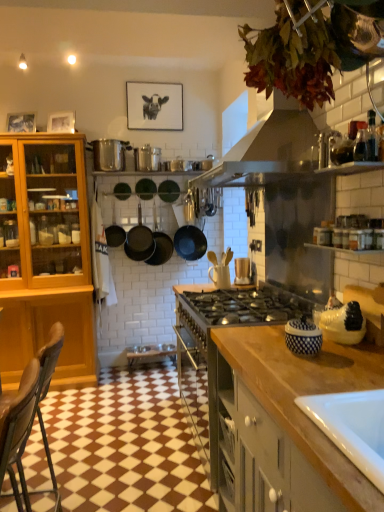
Locate an element on the screen. The image size is (384, 512). free spot to the left of blue and white ceramic jar at right, marked as the 2th appliance in a right-to-left arrangement is located at coordinates (264, 347).